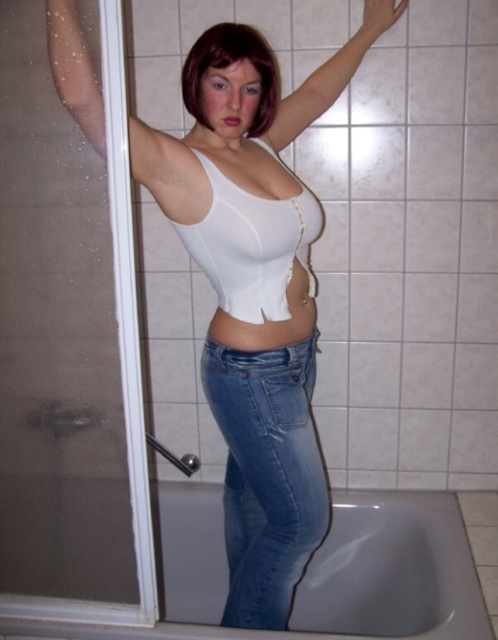
Question: Is blue denim jeans at lower center above brushed metal grab bar at lower left?

Choices:
 (A) no
 (B) yes

Answer: (B)

Question: Which point appears farthest from the camera in this image?

Choices:
 (A) (134, 520)
 (B) (284, 568)

Answer: (B)

Question: Among these objects, which one is nearest to the camera?

Choices:
 (A) white glossy bathtub at lower center
 (B) brushed metal grab bar at lower left
 (C) white matte tank top at center
 (D) transparent glass screen door at left

Answer: (C)

Question: Is blue denim jeans at lower center thinner than transparent glass screen door at left?

Choices:
 (A) yes
 (B) no

Answer: (A)

Question: Which point is closer to the camera?

Choices:
 (A) (326, 486)
 (B) (301, 186)
 (C) (406, 596)

Answer: (B)

Question: Can you confirm if white glossy bathtub at lower center is positioned to the right of blue denim jeans at lower center?

Choices:
 (A) yes
 (B) no

Answer: (A)